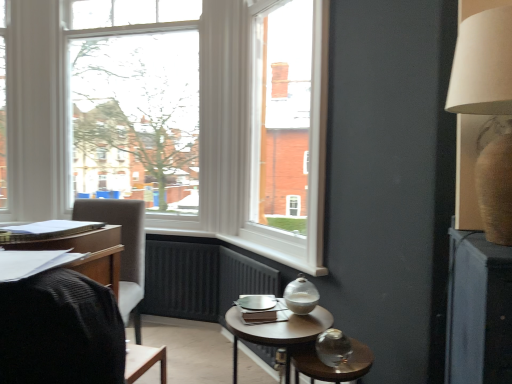
Question: Can you confirm if matte blue book at left is thinner than knitted fabric chair at left?

Choices:
 (A) yes
 (B) no

Answer: (A)

Question: Is there a large distance between matte blue book at left and knitted fabric chair at left?

Choices:
 (A) no
 (B) yes

Answer: (A)

Question: Can you confirm if matte blue book at left is wider than knitted fabric chair at left?

Choices:
 (A) yes
 (B) no

Answer: (B)

Question: From a real-world perspective, is matte blue book at left over knitted fabric chair at left?

Choices:
 (A) no
 (B) yes

Answer: (B)

Question: Is matte blue book at left not within knitted fabric chair at left?

Choices:
 (A) no
 (B) yes

Answer: (B)

Question: Can you confirm if matte blue book at left is taller than knitted fabric chair at left?

Choices:
 (A) no
 (B) yes

Answer: (A)

Question: Are clear glass window at upper left and transparent glass table at lower right located far from each other?

Choices:
 (A) yes
 (B) no

Answer: (A)

Question: Can you confirm if clear glass window at upper left is thinner than transparent glass table at lower right?

Choices:
 (A) no
 (B) yes

Answer: (B)

Question: From a real-world perspective, is clear glass window at upper left on top of transparent glass table at lower right?

Choices:
 (A) no
 (B) yes

Answer: (B)

Question: Is transparent glass table at lower right located within clear glass window at upper left?

Choices:
 (A) no
 (B) yes

Answer: (A)

Question: From the image's perspective, is clear glass window at upper left above transparent glass table at lower right?

Choices:
 (A) yes
 (B) no

Answer: (A)

Question: Is clear glass window at upper left facing away from transparent glass table at lower right?

Choices:
 (A) yes
 (B) no

Answer: (B)

Question: Is matte black desk at left looking in the opposite direction of beige fabric lampshade at upper right?

Choices:
 (A) no
 (B) yes

Answer: (A)